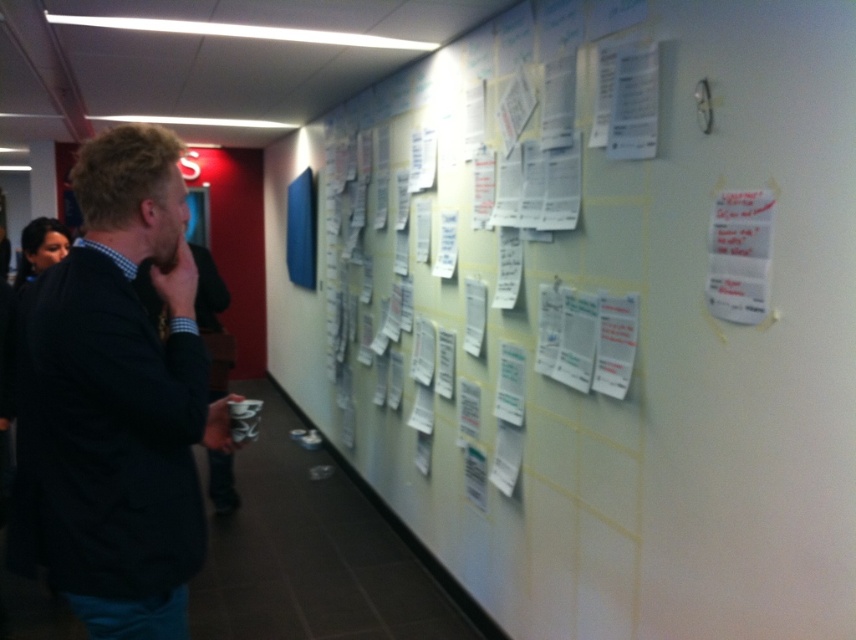
Can you confirm if white paper at upper center is shorter than dark blue sweater at left?

No, white paper at upper center is not shorter than dark blue sweater at left.

Can you confirm if white paper at upper center is positioned below dark blue sweater at left?

No.

The width and height of the screenshot is (856, 640). Find the location of `white paper at upper center`. white paper at upper center is located at coordinates (597, 312).

Find the location of a particular element. Image resolution: width=856 pixels, height=640 pixels. white paper at upper center is located at coordinates (597, 312).